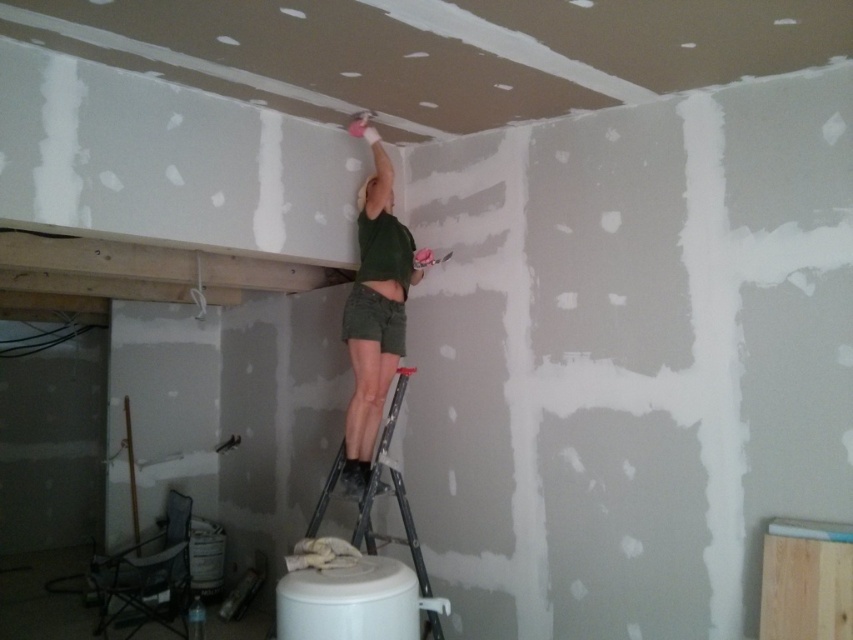
Question: Does green matte shirt at upper center have a greater width compared to metallic silver ladder at center?

Choices:
 (A) yes
 (B) no

Answer: (B)

Question: Which of the following is the farthest from the observer?

Choices:
 (A) (328, 492)
 (B) (410, 276)

Answer: (B)

Question: Can you confirm if green matte shirt at upper center is positioned to the right of metallic silver ladder at center?

Choices:
 (A) yes
 (B) no

Answer: (A)

Question: Is the position of green matte shirt at upper center more distant than that of metallic silver ladder at center?

Choices:
 (A) no
 (B) yes

Answer: (B)